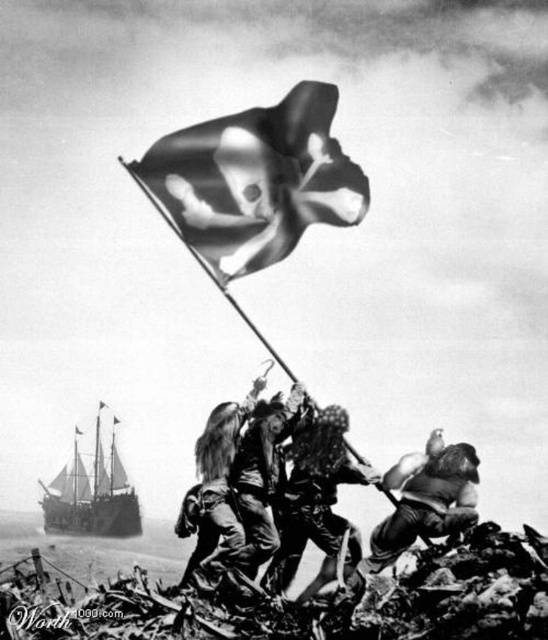
Question: Which point is farther from the camera taking this photo?

Choices:
 (A) (99, 410)
 (B) (75, 524)

Answer: (B)

Question: Is ruffled fabric pirate flag at upper center bigger than ruffled fabric pirate flag at center?

Choices:
 (A) yes
 (B) no

Answer: (B)

Question: Where is rugged fabric soldier at center located in relation to rugged leather helmet at lower right in the image?

Choices:
 (A) below
 (B) above

Answer: (B)

Question: Based on their relative distances, which object is farther from the wooden ship at lower left?

Choices:
 (A) rugged fabric soldier at center
 (B) shiny metallic flag at upper center
 (C) rugged leather helmet at lower right
 (D) ruffled fabric pirate flag at upper center

Answer: (B)

Question: Does shiny metallic flag at upper center have a smaller size compared to ruffled fabric skull at upper center?

Choices:
 (A) yes
 (B) no

Answer: (B)

Question: Which point is closer to the camera?

Choices:
 (A) rugged fabric soldier at center
 (B) ruffled fabric pirate flag at center
 (C) ruffled fabric skull at upper center
 (D) rugged leather helmet at lower right

Answer: (D)